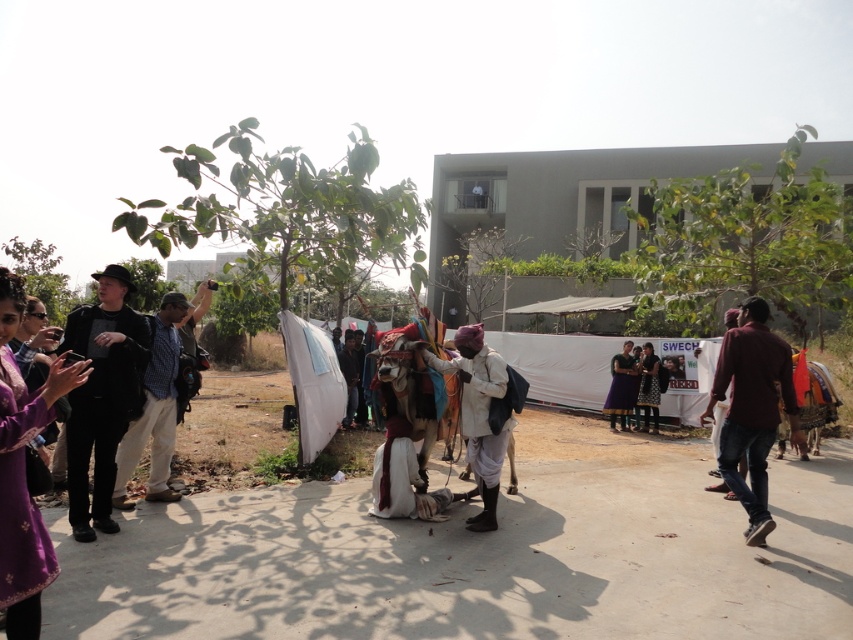
Can you confirm if black matte jacket at left is positioned below dark purple dress at center?

Incorrect, black matte jacket at left is not positioned below dark purple dress at center.

Can you confirm if black matte jacket at left is positioned to the right of dark purple dress at center?

No, black matte jacket at left is not to the right of dark purple dress at center.

Between point (73, 323) and point (647, 356), which one is positioned in front?

Point (73, 323)

Image resolution: width=853 pixels, height=640 pixels. Identify the location of black matte jacket at left. (102, 396).

You are a GUI agent. You are given a task and a screenshot of the screen. Output one action in this format:
    pyautogui.click(x=<x>, y=<y>)
    Task: Click on the white cotton turban at center
    
    Given the screenshot: What is the action you would take?
    pyautogui.click(x=479, y=413)

Can you confirm if white cotton turban at center is thinner than dark purple fabric at center?

Correct, white cotton turban at center's width is less than dark purple fabric at center's.

This screenshot has width=853, height=640. I want to click on white cotton turban at center, so click(479, 413).

Between point (616, 360) and point (712, 404), which one is positioned in front?

Point (712, 404) is more forward.

At what (x,y) coordinates should I click in order to perform the action: click on dark purple fabric at center. Please return your answer as a coordinate pair (x, y). This screenshot has height=640, width=853. Looking at the image, I should click on (621, 387).